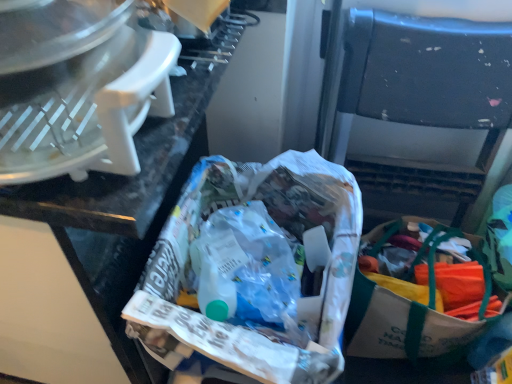
Question: Is white plastic food processor at upper left located outside white paper bag at center?

Choices:
 (A) no
 (B) yes

Answer: (B)

Question: From the image's perspective, is white plastic food processor at upper left on white paper bag at center?

Choices:
 (A) no
 (B) yes

Answer: (B)

Question: From a real-world perspective, is white plastic food processor at upper left physically above white paper bag at center?

Choices:
 (A) yes
 (B) no

Answer: (A)

Question: Can you confirm if white plastic food processor at upper left is thinner than white paper bag at center?

Choices:
 (A) yes
 (B) no

Answer: (A)

Question: Is white plastic food processor at upper left aimed at white paper bag at center?

Choices:
 (A) yes
 (B) no

Answer: (B)

Question: From the image's perspective, relative to white paper bag at center, is white plastic food processor at upper left above or below?

Choices:
 (A) above
 (B) below

Answer: (A)

Question: Is white plastic food processor at upper left wider or thinner than white paper bag at center?

Choices:
 (A) wide
 (B) thin

Answer: (B)

Question: Considering the relative positions of white plastic food processor at upper left and white paper bag at center in the image provided, is white plastic food processor at upper left to the left or to the right of white paper bag at center?

Choices:
 (A) left
 (B) right

Answer: (A)

Question: Is point (40, 77) positioned closer to the camera than point (340, 311)?

Choices:
 (A) farther
 (B) closer

Answer: (B)

Question: Is white paper bag at center taller or shorter than white plastic food processor at upper left?

Choices:
 (A) tall
 (B) short

Answer: (A)

Question: In the image, is white paper bag at center positioned in front of or behind white plastic food processor at upper left?

Choices:
 (A) front
 (B) behind

Answer: (B)

Question: Looking at the image, does white paper bag at center seem bigger or smaller compared to white plastic food processor at upper left?

Choices:
 (A) big
 (B) small

Answer: (A)

Question: Is white paper bag at center situated inside white plastic food processor at upper left or outside?

Choices:
 (A) inside
 (B) outside

Answer: (B)

Question: Is point (415, 36) positioned closer to the camera than point (209, 344)?

Choices:
 (A) farther
 (B) closer

Answer: (A)

Question: Considering the positions of black plastic folding chair at center and white paper bag at center in the image, is black plastic folding chair at center bigger or smaller than white paper bag at center?

Choices:
 (A) small
 (B) big

Answer: (A)